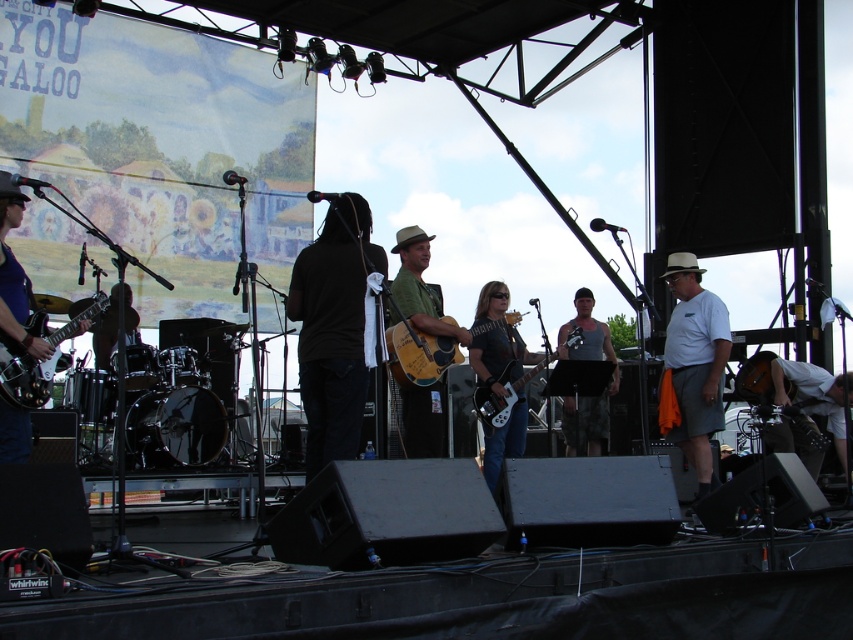
You are a photographer at the live music performance. You need to capture a photo that includes both the matte black guitar at center and the matte black electric guitar at center. Which guitar should you position on the left side of your frame to ensure both are visible?

The matte black guitar at center should be positioned on the left side of your frame because it is already on the left side of the matte black electric guitar at center, ensuring both guitars are visible in the photo.

You are a stagehand carrying a 14 inch long amplifier. You need to place it between the matte black guitar at center and the matte black electric guitar at center. Is there enough space between them to fit the amplifier?

The distance between the matte black guitar at center and the matte black electric guitar at center is 13.32 inches. Since the amplifier is 14 inches long, there isn not enough space to fit it between them.